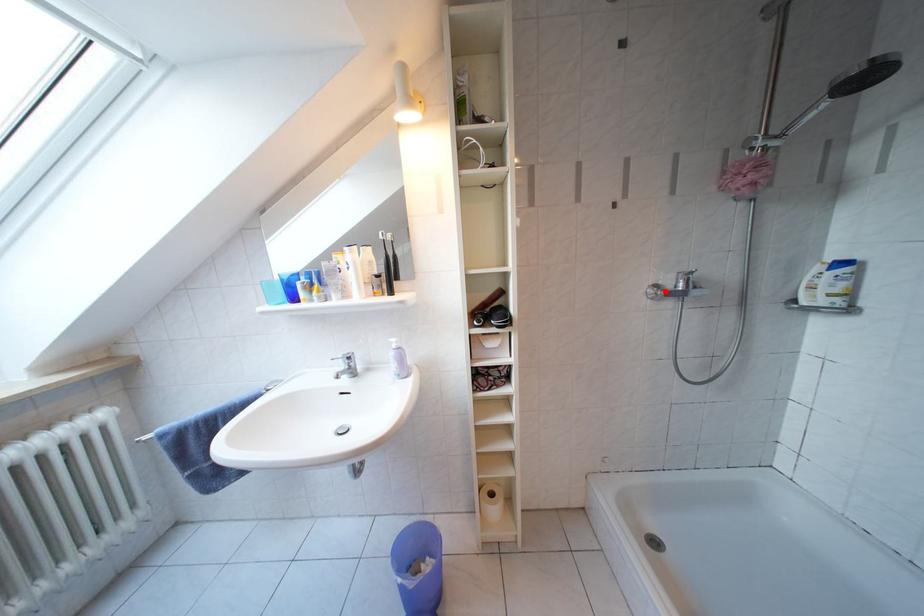
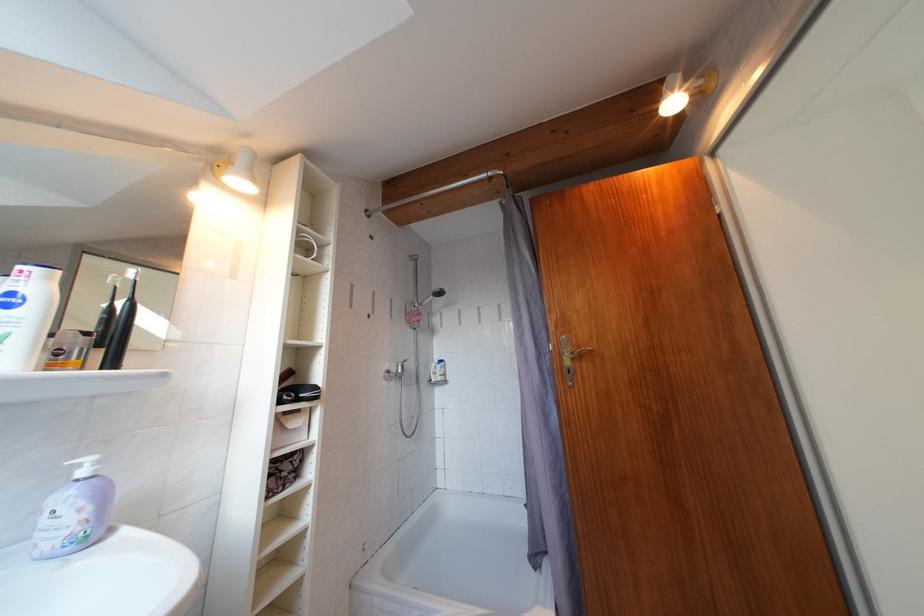
In the second image, find the point that corresponds to the highlighted location in the first image.

(396, 377)